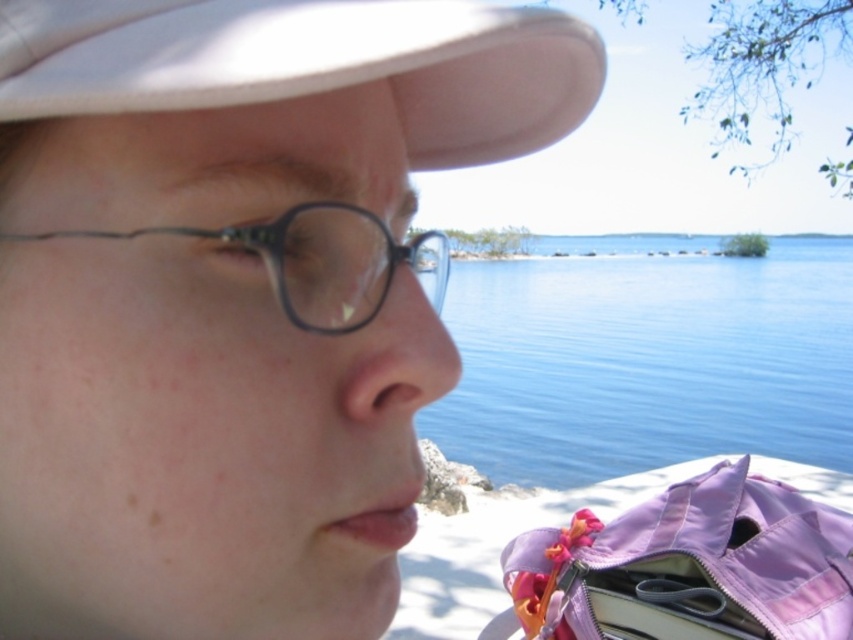
What are the coordinates of the blue water at center in the image?

The blue water at center is located at coordinates point (647, 358).

You are a photographer adjusting the camera focus. The subject has a white matte baseball cap at upper left and black plastic glasses at left. Which object should you focus on first if you want to ensure the taller object is in sharp focus?

The white matte baseball cap at upper left is taller than the black plastic glasses at left, so you should focus on the white matte baseball cap at upper left first to ensure it is in sharp focus.